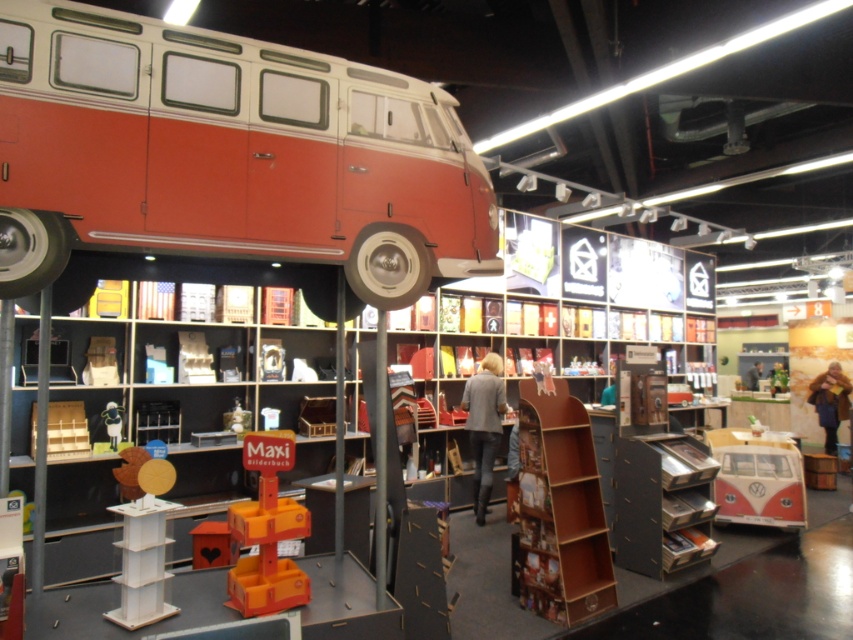
You are an interior designer planning to place a new decorative item on the shelf. You have a wooden block at lower left and a light brown leather jacket at center. Which object is narrower so it can fit better in a narrow space?

The wooden block at lower left is narrower than the light brown leather jacket at center, so it can fit better in a narrow space.

Based on the photo, you are an interior designer planning to place a new shelf between the wooden at center and the wooden block at lower left. Which object should the shelf be wider than to accommodate both?

The shelf should be wider than the wooden at center since it is wider than the wooden block at lower left.